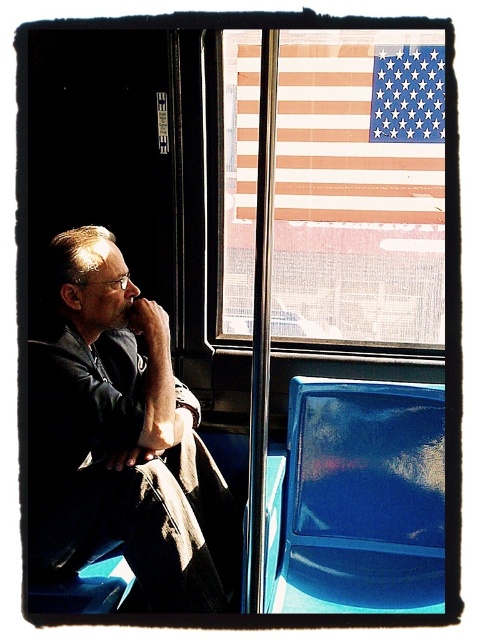
Question: Among these points, which one is nearest to the camera?

Choices:
 (A) (361, 189)
 (B) (51, 244)

Answer: (B)

Question: Among these points, which one is nearest to the camera?

Choices:
 (A) (403, 81)
 (B) (301, 454)
 (C) (88, 372)

Answer: (C)

Question: Is the position of glossy blue seat at lower right more distant than that of american flag at upper right?

Choices:
 (A) no
 (B) yes

Answer: (A)

Question: Which point is farther from the camera taking this photo?

Choices:
 (A) (240, 173)
 (B) (176, 552)
 (C) (385, 477)

Answer: (A)

Question: Is matte black coat at left positioned in front of american flag at upper right?

Choices:
 (A) yes
 (B) no

Answer: (A)

Question: Is matte black coat at left in front of american flag at upper right?

Choices:
 (A) yes
 (B) no

Answer: (A)